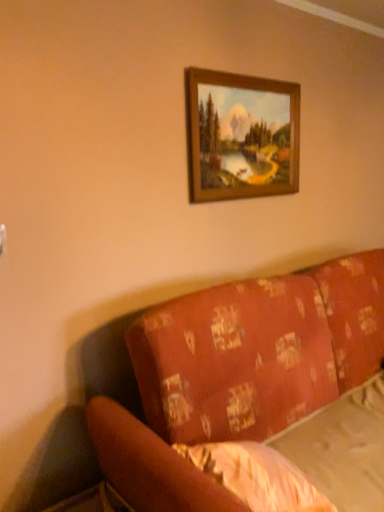
Question: Is wooden frame at upper center placed right next to patterned fabric couch at lower right?

Choices:
 (A) no
 (B) yes

Answer: (A)

Question: Does wooden frame at upper center lie in front of patterned fabric couch at lower right?

Choices:
 (A) yes
 (B) no

Answer: (B)

Question: Does wooden frame at upper center have a lesser height compared to patterned fabric couch at lower right?

Choices:
 (A) yes
 (B) no

Answer: (A)

Question: Is patterned fabric couch at lower right surrounded by wooden frame at upper center?

Choices:
 (A) no
 (B) yes

Answer: (A)

Question: Is wooden frame at upper center to the left of patterned fabric couch at lower right from the viewer's perspective?

Choices:
 (A) yes
 (B) no

Answer: (A)

Question: Choose the correct answer: Is white textured sheet at lower right inside wooden frame at upper center or outside it?

Choices:
 (A) outside
 (B) inside

Answer: (A)

Question: Is point [x=273, y=451] closer or farther from the camera than point [x=240, y=139]?

Choices:
 (A) closer
 (B) farther

Answer: (A)

Question: Considering the positions of white textured sheet at lower right and wooden frame at upper center in the image, is white textured sheet at lower right wider or thinner than wooden frame at upper center?

Choices:
 (A) wide
 (B) thin

Answer: (A)

Question: Based on their sizes in the image, would you say white textured sheet at lower right is bigger or smaller than wooden frame at upper center?

Choices:
 (A) big
 (B) small

Answer: (A)

Question: Would you say wooden frame at upper center is to the left or to the right of white textured sheet at lower right in the picture?

Choices:
 (A) right
 (B) left

Answer: (A)

Question: From a real-world perspective, is wooden frame at upper center above or below white textured sheet at lower right?

Choices:
 (A) above
 (B) below

Answer: (A)

Question: In the image, is wooden frame at upper center positioned in front of or behind white textured sheet at lower right?

Choices:
 (A) behind
 (B) front

Answer: (A)

Question: Choose the correct answer: Is wooden frame at upper center inside white textured sheet at lower right or outside it?

Choices:
 (A) outside
 (B) inside

Answer: (A)

Question: From the image's perspective, is patterned fabric couch at lower right positioned above or below white textured sheet at lower right?

Choices:
 (A) below
 (B) above

Answer: (B)

Question: Is patterned fabric couch at lower right in front of or behind white textured sheet at lower right in the image?

Choices:
 (A) behind
 (B) front

Answer: (B)